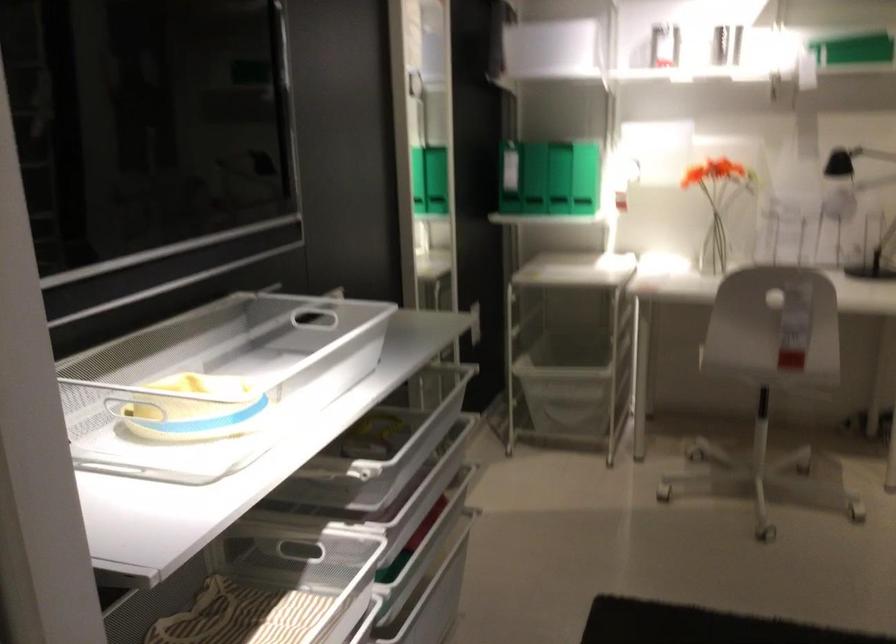
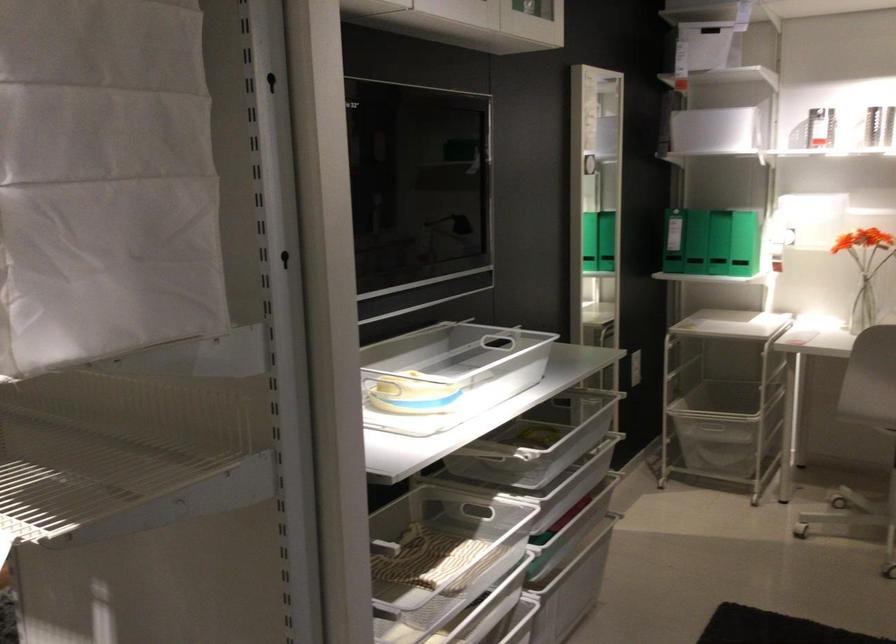
The point at (400,413) is marked in the first image. Where is the corresponding point in the second image?

(561, 428)